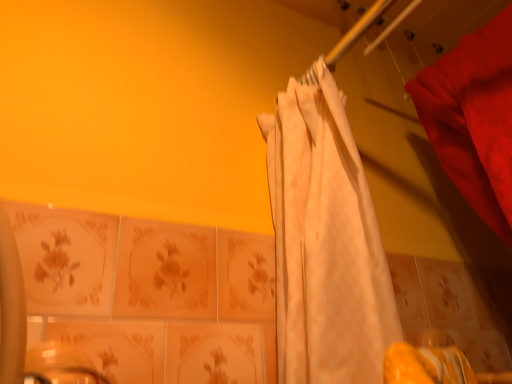
At what (x,y) coordinates should I click in order to perform the action: click on white sheer curtain at center. Please return your answer as a coordinate pair (x, y). This screenshot has height=384, width=512. Looking at the image, I should click on (325, 242).

The width and height of the screenshot is (512, 384). What do you see at coordinates (325, 242) in the screenshot? I see `white sheer curtain at center` at bounding box center [325, 242].

In order to face white sheer curtain at center, should I rotate leftwards or rightwards?

Turn right by 4.459 degrees to look at white sheer curtain at center.

The height and width of the screenshot is (384, 512). What are the coordinates of `white sheer curtain at center` in the screenshot? It's located at (325, 242).